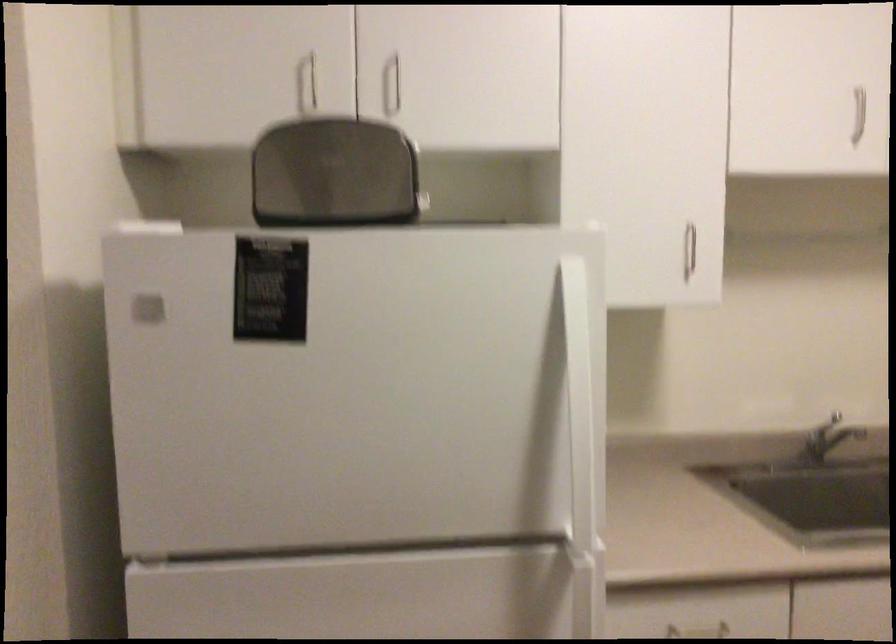
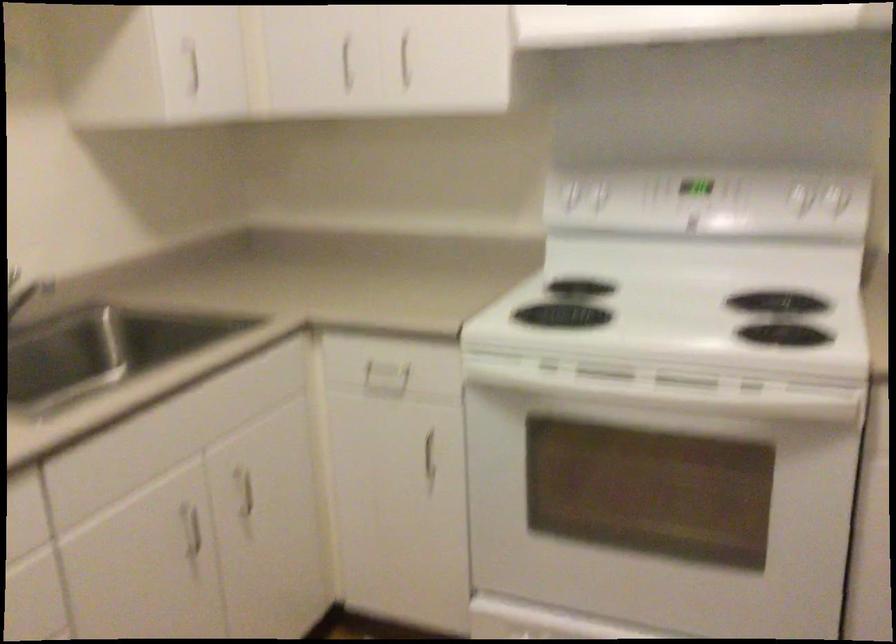
Question: How did the camera likely rotate?

Choices:
 (A) Left
 (B) Right
 (C) Up
 (D) Down

Answer: (B)